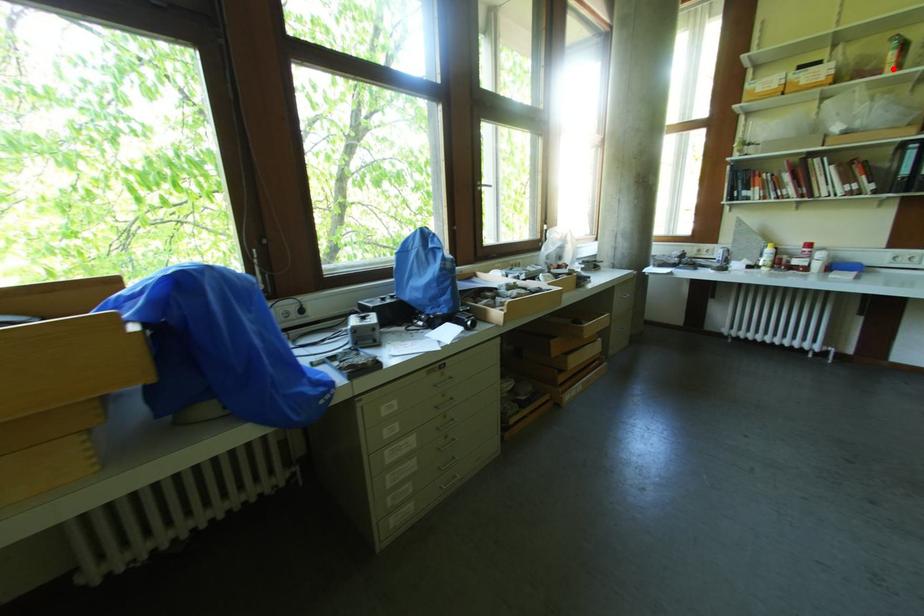
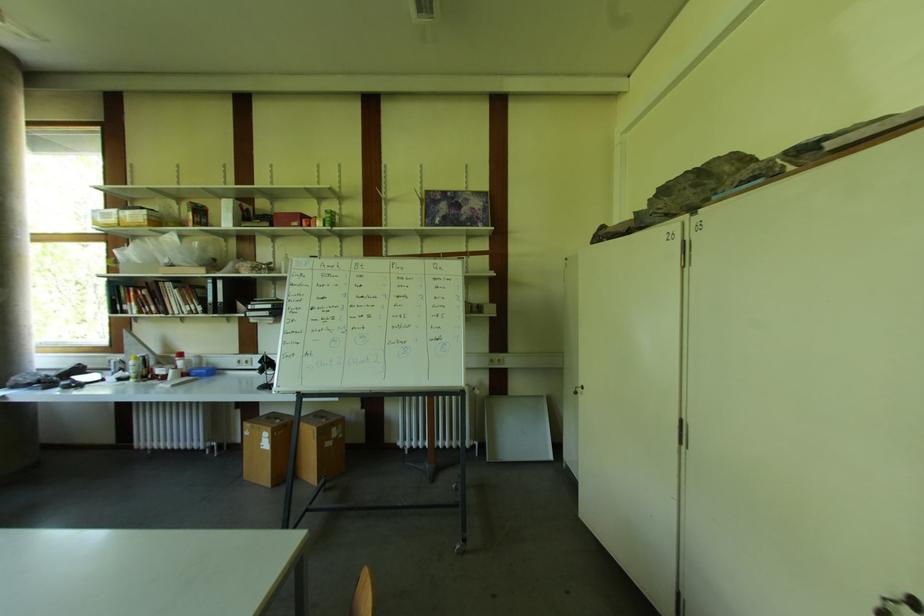
Question: I am providing you with two images of the same scene from different viewpoints. In image1, a red point is highlighted. Considering the same 3D point in image2, which of the following is correct?

Choices:
 (A) It is closer
 (B) It is farther

Answer: (A)